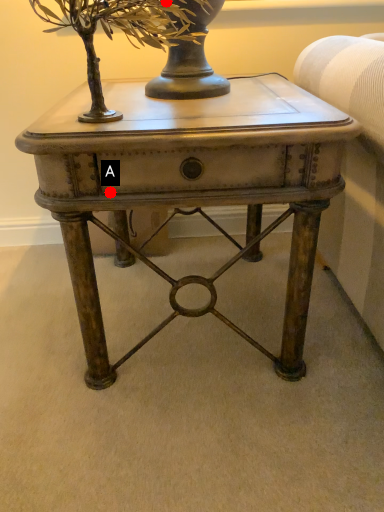
Question: Two points are circled on the image, labeled by A and B beside each circle. Which of the following is the farthest from the observer?

Choices:
 (A) A is further
 (B) B is further

Answer: (A)